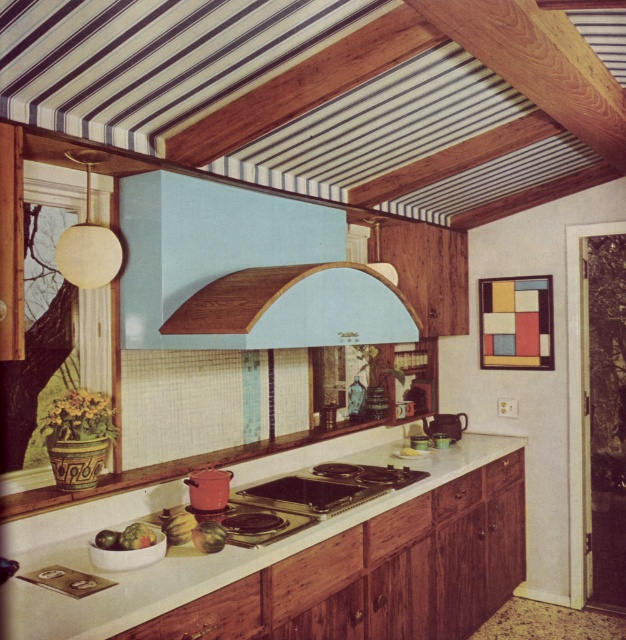
Question: Can you confirm if shiny silver stove at center is thinner than green matte apple at center?

Choices:
 (A) yes
 (B) no

Answer: (B)

Question: Estimate the real-world distances between objects in this image. Which object is closer to the white glossy countertop at center?

Choices:
 (A) wooden/textured exhaust hood at center
 (B) light blue wood exhaust hood at center
 (C) green matte apple at center
 (D) metallic silver stove at center

Answer: (D)

Question: Observing the image, what is the correct spatial positioning of light blue wood exhaust hood at center in reference to white glossy countertop at center?

Choices:
 (A) below
 (B) above

Answer: (B)

Question: Estimate the real-world distances between objects in this image. Which object is closer to the wooden/textured exhaust hood at center?

Choices:
 (A) metallic silver stove at center
 (B) green matte apple at center
 (C) shiny silver stove at center
 (D) light blue wood exhaust hood at center

Answer: (D)

Question: Is light blue wood exhaust hood at center in front of shiny silver stove at center?

Choices:
 (A) yes
 (B) no

Answer: (A)

Question: Based on their relative distances, which object is farther from the white glossy countertop at center?

Choices:
 (A) metallic silver stove at center
 (B) light blue wood exhaust hood at center
 (C) green matte apple at center

Answer: (B)